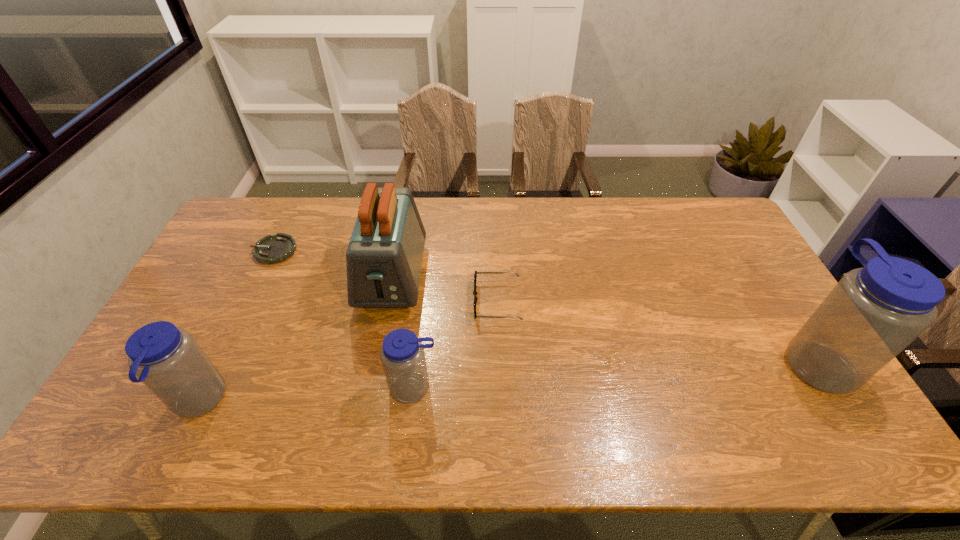
Identify which object is the fifth nearest to the second object from right to left. Please provide its 2D coordinates. Your answer should be formatted as a tuple, i.e. [(x, y)], where the tuple contains the x and y coordinates of a point satisfying the conditions above.

[(873, 313)]

Locate which water bottle is the second closest to the shortest water bottle. Please provide its 2D coordinates. Your answer should be formatted as a tuple, i.e. [(x, y)], where the tuple contains the x and y coordinates of a point satisfying the conditions above.

[(873, 313)]

Locate an element on the screen. the second closest water bottle relative to the leftmost water bottle is located at coordinates (873, 313).

Find the location of a particular element. Image resolution: width=960 pixels, height=540 pixels. free space in the image that satisfies the following two spatial constraints: 1. with a carrying loop on the side of the rightmost water bottle; 2. with a carrying loop on the side of the shortest water bottle is located at coordinates (832, 388).

The image size is (960, 540). In order to click on free space that satisfies the following two spatial constraints: 1. on the front-facing side of the toaster; 2. with a carrying loop on the side of the leftmost water bottle in this screenshot , I will do `click(369, 402)`.